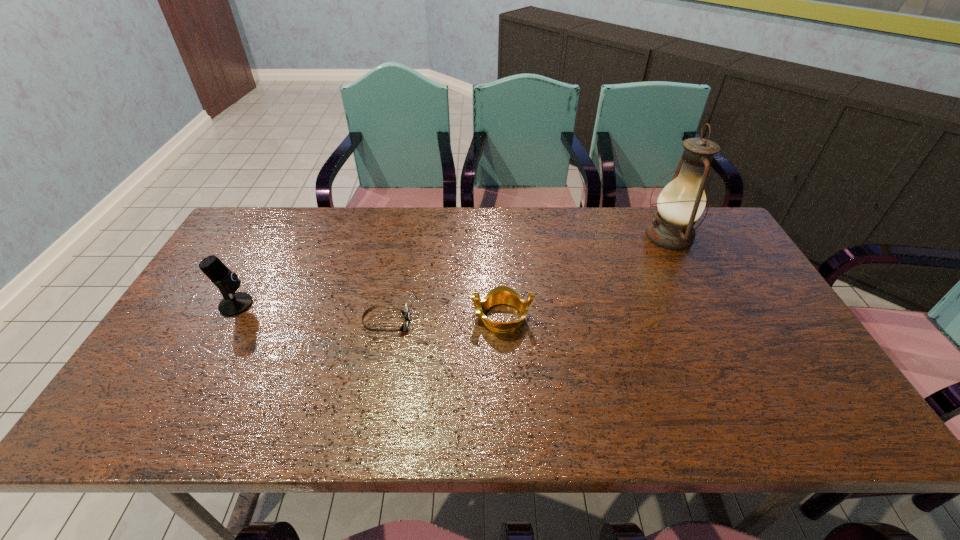
At what (x,y) coordinates should I click in order to perform the action: click on oil lamp. Please return your answer as a coordinate pair (x, y). Looking at the image, I should click on (682, 201).

Find the location of a particular element. Image resolution: width=960 pixels, height=540 pixels. the farthest object is located at coordinates (682, 201).

What are the coordinates of `the third shortest object` in the screenshot? It's located at (232, 304).

Locate an element on the screen. the leftmost object is located at coordinates (232, 304).

Image resolution: width=960 pixels, height=540 pixels. Find the location of `the third tallest object`. the third tallest object is located at coordinates (502, 294).

The height and width of the screenshot is (540, 960). Find the location of `tiara`. tiara is located at coordinates (502, 294).

The image size is (960, 540). Find the location of `goggles`. goggles is located at coordinates (406, 313).

Where is `the shortest object`? This screenshot has height=540, width=960. the shortest object is located at coordinates (406, 313).

At what (x,y) coordinates should I click in order to perform the action: click on free space located 0.110m on the front of the tallest object. Please return your answer as a coordinate pair (x, y). Looking at the image, I should click on (692, 282).

Where is `free region located on the stand of the leftmost object`? free region located on the stand of the leftmost object is located at coordinates (314, 305).